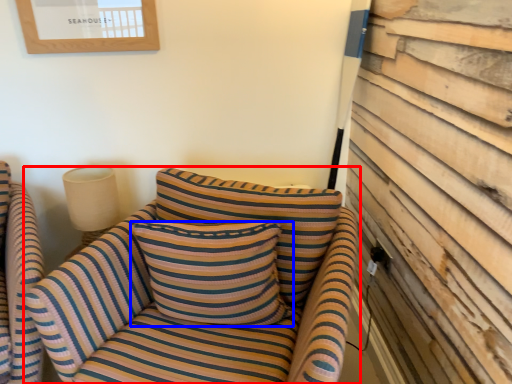
Question: Which point is further to the camera, studio couch (highlighted by a red box) or pillow (highlighted by a blue box)?

Choices:
 (A) studio couch
 (B) pillow

Answer: (B)